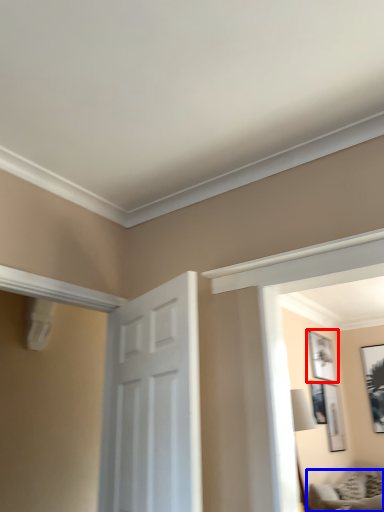
Question: Which object is further to the camera taking this photo, picture frame (highlighted by a red box) or furniture (highlighted by a blue box)?

Choices:
 (A) picture frame
 (B) furniture

Answer: (A)